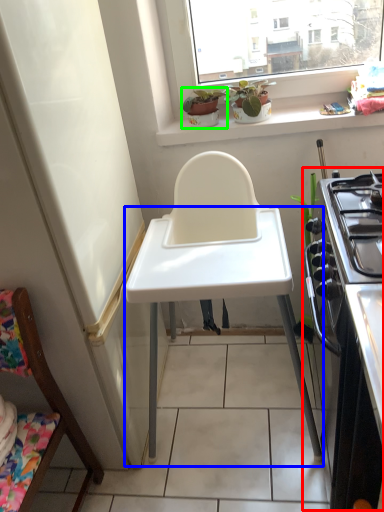
Question: Based on their relative distances, which object is farther from appliance (highlighted by a red box)? Choose from table (highlighted by a blue box) and houseplant (highlighted by a green box).

Choices:
 (A) table
 (B) houseplant

Answer: (B)